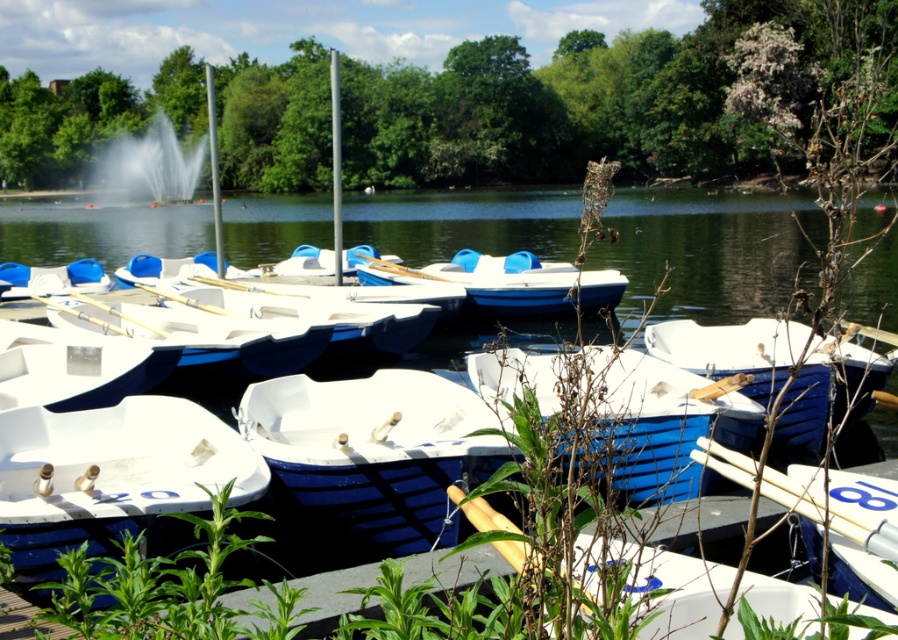
Between white matte boat at center and white water at center, which one appears on the right side from the viewer's perspective?

white matte boat at center is more to the right.

Can you confirm if white matte boat at center is bigger than white water at center?

Actually, white matte boat at center might be smaller than white water at center.

Between point (154, 412) and point (104, 157), which one is positioned behind?

The point (104, 157) is more distant.

You are a GUI agent. You are given a task and a screenshot of the screen. Output one action in this format:
    pyautogui.click(x=<x>, y=<y>)
    Task: Click on the white matte boat at center
    
    Given the screenshot: What is the action you would take?
    pyautogui.click(x=112, y=480)